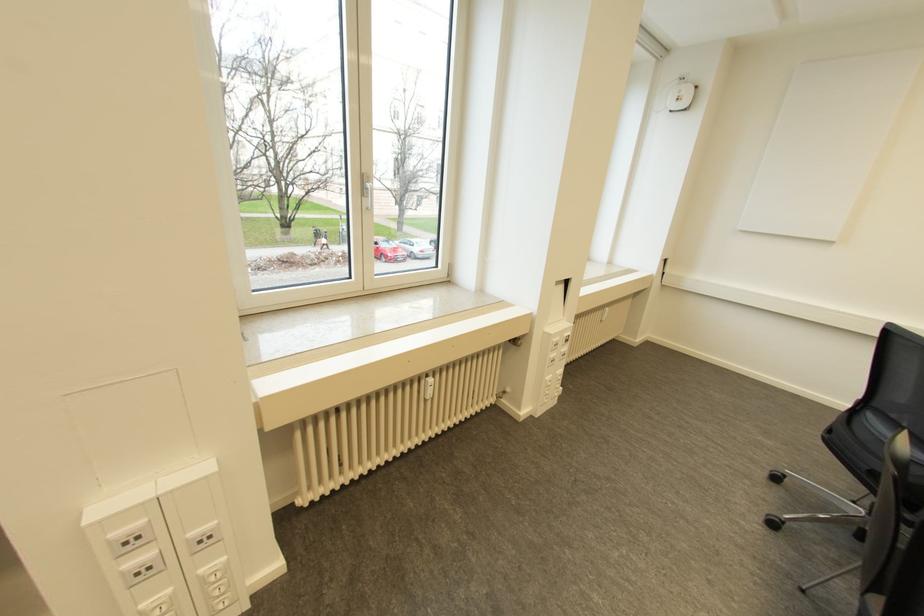
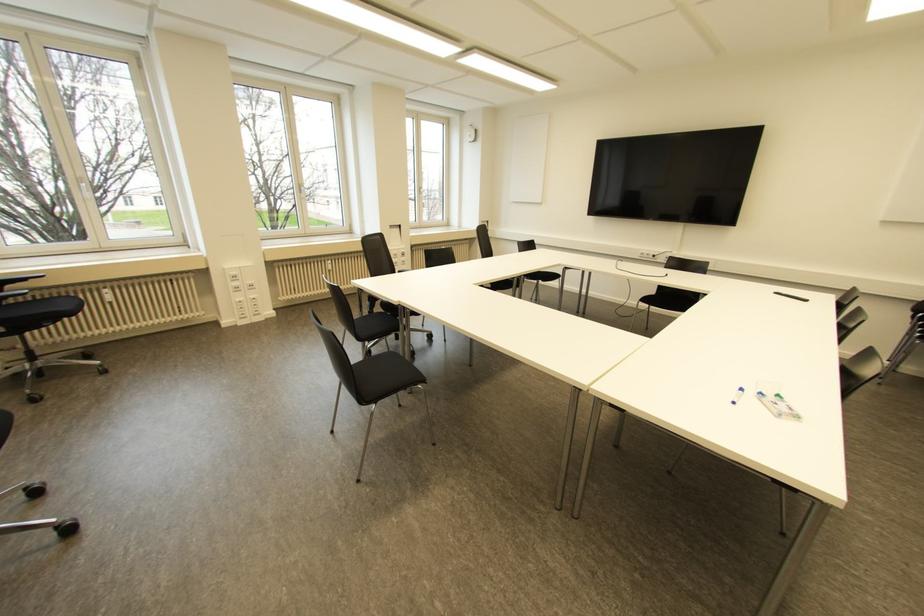
The images are taken continuously from a first-person perspective. In which direction are you moving?

The cameraman walked toward right, backward.